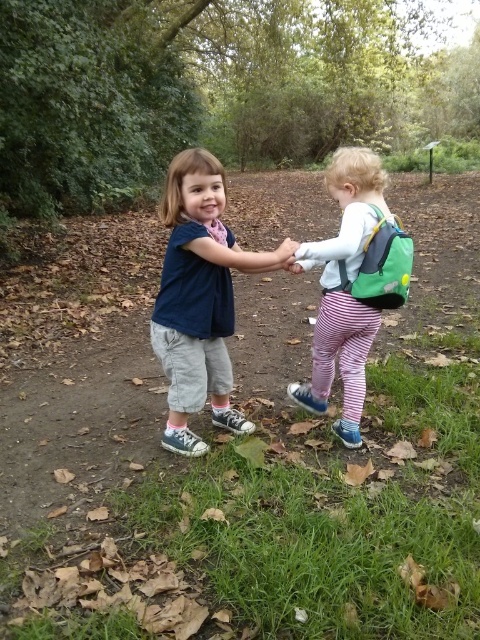
Question: Is the position of matte blue shirt at center less distant than that of green fabric backpack at right?

Choices:
 (A) yes
 (B) no

Answer: (A)

Question: Which is farther from the matte blue shirt at center?

Choices:
 (A) green fabric backpack at right
 (B) striped cotton pants at center

Answer: (B)

Question: Which object is positioned closest to the green fabric backpack at right?

Choices:
 (A) striped cotton pants at center
 (B) matte blue shirt at center

Answer: (B)

Question: Which point is farther to the camera?

Choices:
 (A) pos(340,266)
 (B) pos(338,241)

Answer: (A)

Question: Is matte blue shirt at center thinner than striped cotton pants at center?

Choices:
 (A) no
 (B) yes

Answer: (B)

Question: Is striped cotton pants at center positioned behind green fabric backpack at right?

Choices:
 (A) yes
 (B) no

Answer: (B)